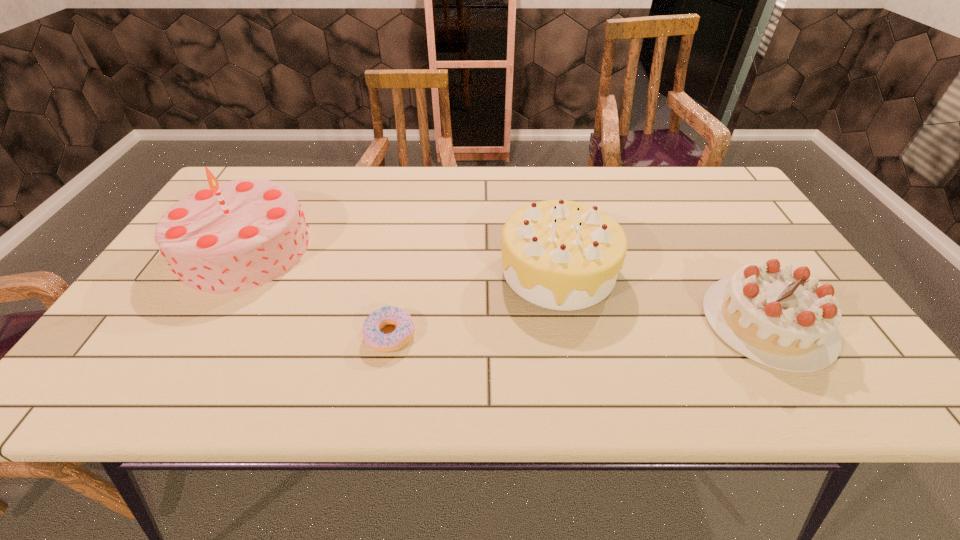
The height and width of the screenshot is (540, 960). In order to click on the tallest object in this screenshot , I will do `click(229, 237)`.

The image size is (960, 540). Find the location of `the leftmost birthday cake`. the leftmost birthday cake is located at coordinates point(229,237).

The image size is (960, 540). Find the location of `the third shortest object`. the third shortest object is located at coordinates (564, 255).

The image size is (960, 540). I want to click on the second object from right to left, so click(564, 255).

Locate an element on the screen. The image size is (960, 540). the rightmost birthday cake is located at coordinates (778, 316).

In order to click on the shortest birthday cake in this screenshot , I will do coord(778,316).

This screenshot has height=540, width=960. In order to click on the second object from left to right in this screenshot , I will do `click(374, 338)`.

Where is `doughnut`? The height and width of the screenshot is (540, 960). doughnut is located at coordinates click(374, 338).

The image size is (960, 540). In order to click on vacant space located on the right of the tallest object in this screenshot , I will do `click(457, 249)`.

You are a GUI agent. You are given a task and a screenshot of the screen. Output one action in this format:
    pyautogui.click(x=<x>, y=<y>)
    Task: Click on the free space located on the left of the second tallest object
    This screenshot has height=540, width=960.
    Given the screenshot: What is the action you would take?
    pyautogui.click(x=365, y=270)